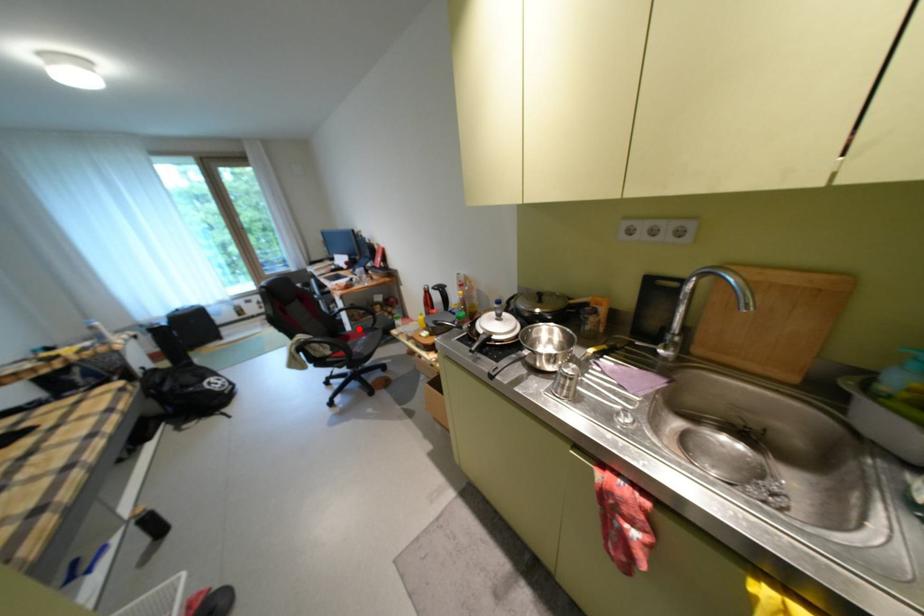
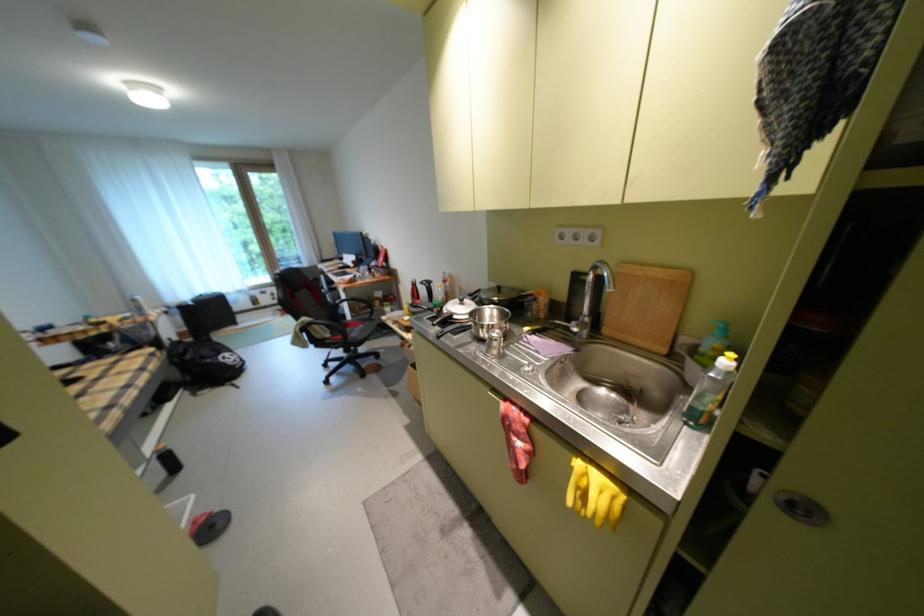
Where in the second image is the point corresponding to the highlighted location from the first image?

(359, 318)